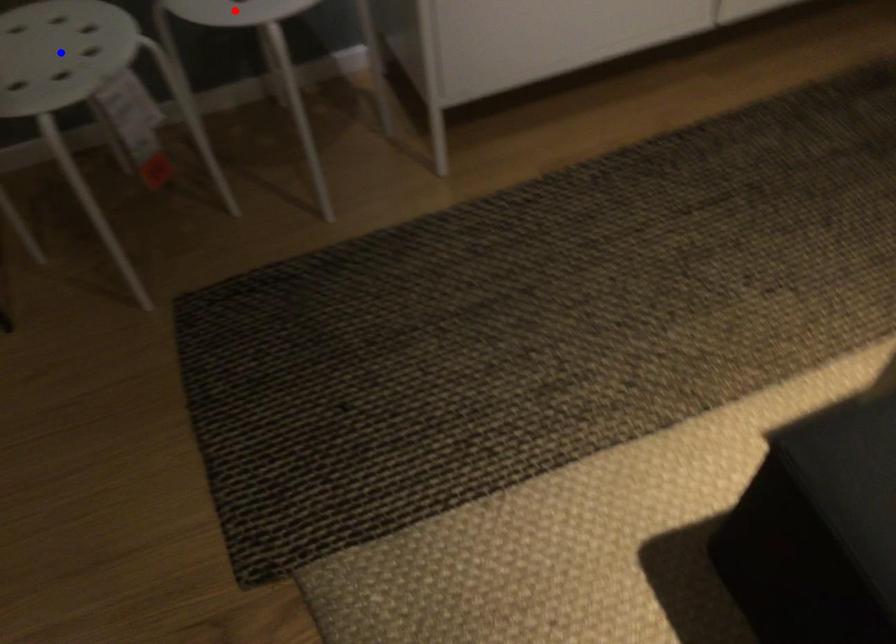
Question: In the image, two points are highlighted. Which point is nearer to the camera? Reply with the corresponding letter.

Choices:
 (A) blue point
 (B) red point

Answer: (A)